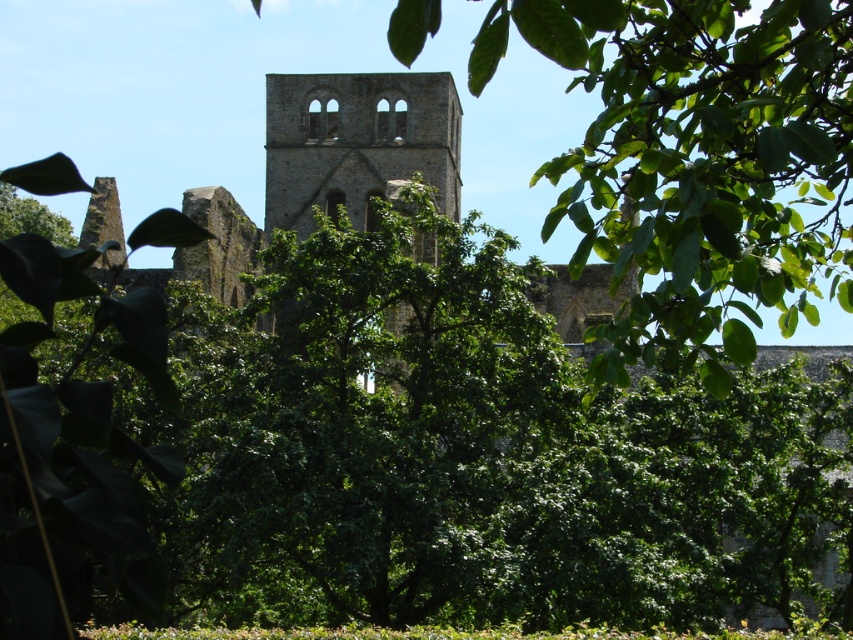
Looking at this image, which is more to the left, green leafy tree at center or brown stone tower at center?

Positioned to the left is green leafy tree at center.

Is green leafy tree at center thinner than brown stone tower at center?

No.

This screenshot has width=853, height=640. Describe the element at coordinates (425, 448) in the screenshot. I see `green leafy tree at center` at that location.

Where is `green leafy tree at center`? This screenshot has height=640, width=853. green leafy tree at center is located at coordinates (425, 448).